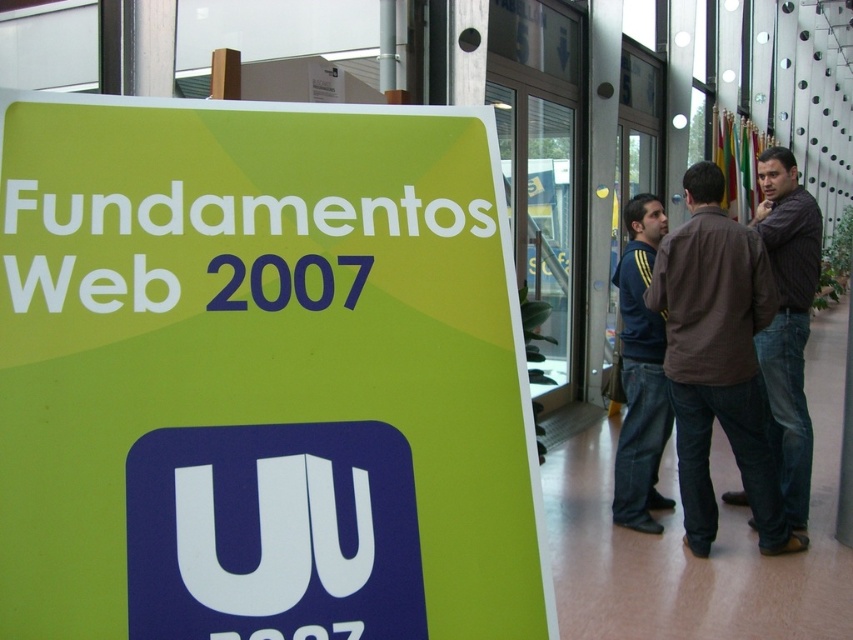
Question: Is brown striped shirt at right closer to the viewer compared to dark blue jeans at center?

Choices:
 (A) no
 (B) yes

Answer: (B)

Question: Based on their relative distances, which object is nearer to the green paper sign at left?

Choices:
 (A) dark blue jeans at center
 (B) brown striped shirt at right

Answer: (B)

Question: Does brown cotton shirt at right appear under brown striped shirt at right?

Choices:
 (A) yes
 (B) no

Answer: (A)

Question: Which object is closer to the camera taking this photo?

Choices:
 (A) brown striped shirt at right
 (B) green paper sign at left
 (C) brown cotton shirt at right

Answer: (B)

Question: Considering the relative positions of brown striped shirt at right and dark blue jeans at center in the image provided, where is brown striped shirt at right located with respect to dark blue jeans at center?

Choices:
 (A) below
 (B) above

Answer: (B)

Question: Which of the following is the closest to the observer?

Choices:
 (A) brown striped shirt at right
 (B) green paper sign at left

Answer: (B)